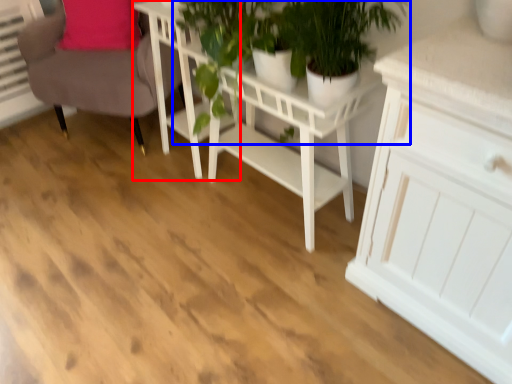
Question: Which of the following is the closest to the observer, table (highlighted by a red box) or houseplant (highlighted by a blue box)?

Choices:
 (A) table
 (B) houseplant

Answer: (B)